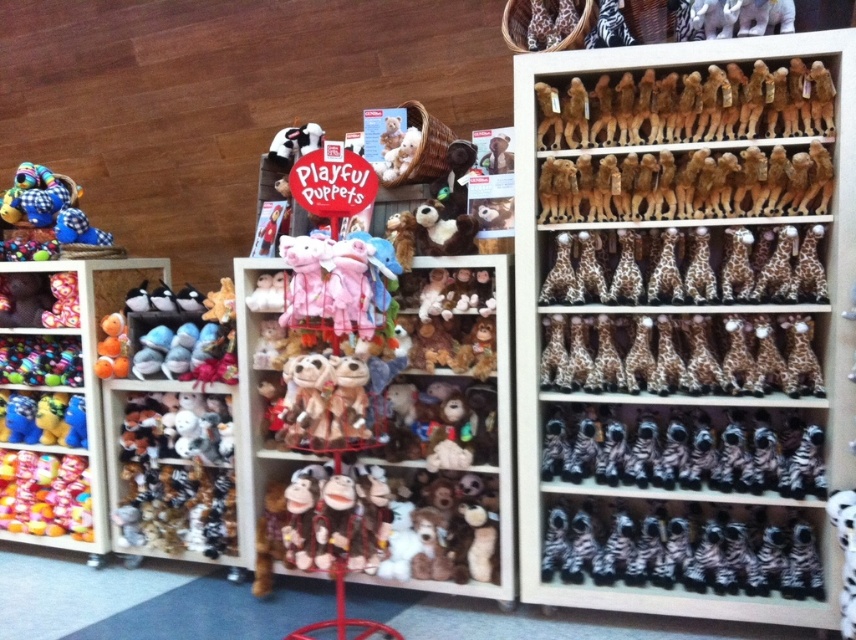
You are standing in front of the plush toy store section and want to pick up an item. There are two points marked in the image, point 1 at coordinate (x=16, y=506) and point 2 at coordinate (x=290, y=193). Which point is closer to you?

Point 1 at coordinate (x=16, y=506) is closer to you because it is further to the camera than point 2 at coordinate (x=290, y=193).

You are a customer looking for the brown plush giraffes at right. According to the store layout, where exactly are they positioned in relation to the other items?

The brown plush giraffes at right are located at point (684, 324), which places them in the central display area of the store section dedicated to plush toys and stuffed animals.

You are standing in the store and want to reach both the point at coordinates (495, 394) and the point at (575, 532). Which point will you reach first?

You will reach point (495, 394) first because it is closer to you than point (575, 532), which is further away.